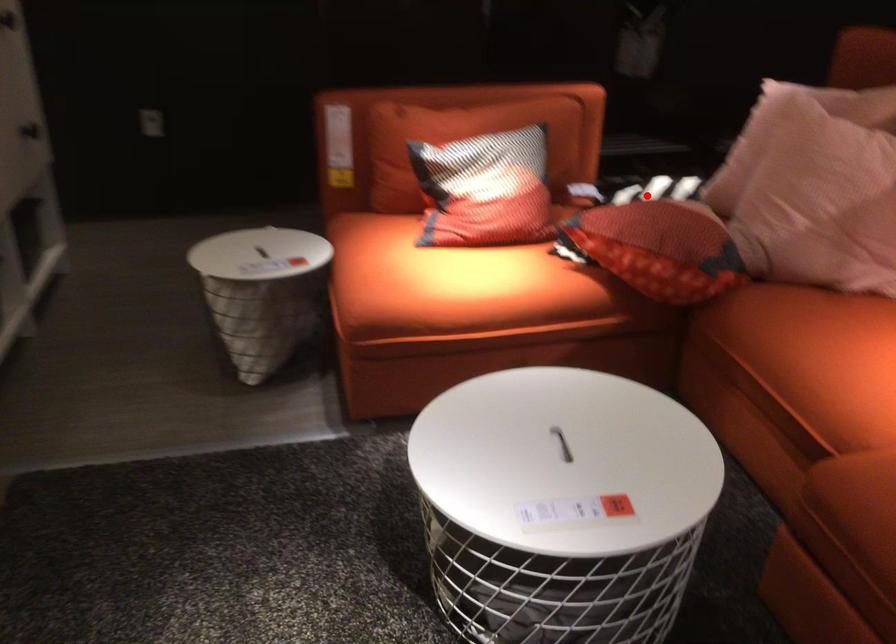
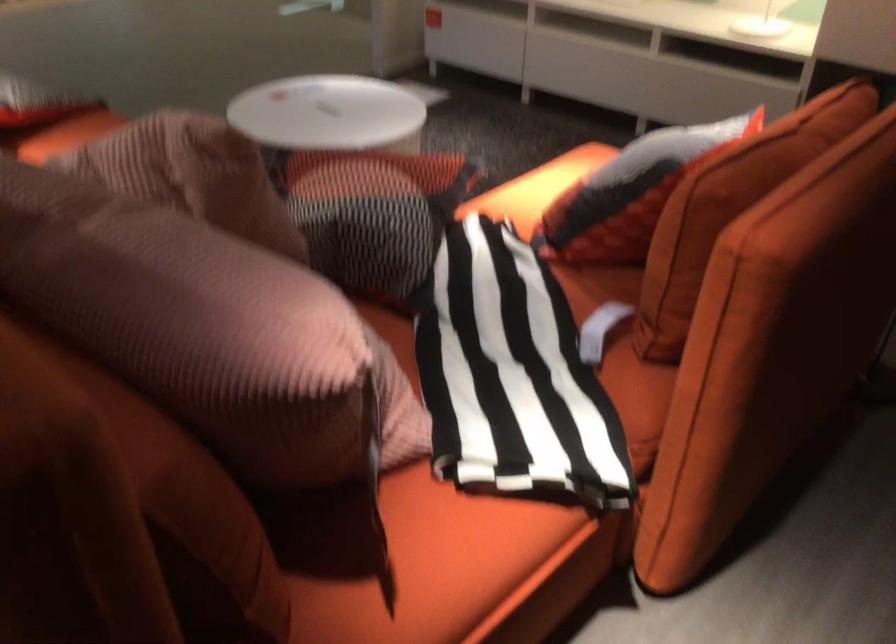
Find the pixel in the second image that matches the highlighted location in the first image.

(512, 375)